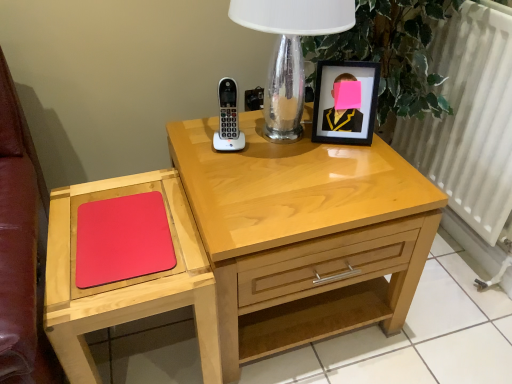
Locate an element on the screen. vacant area that lies to the right of white plastic phone at center is located at coordinates (281, 152).